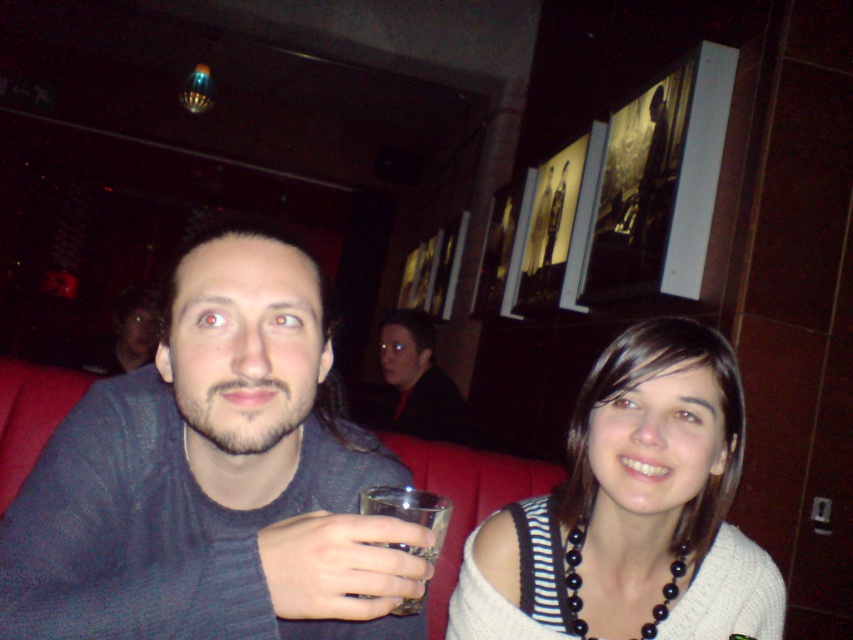
Question: Which point is closer to the camera?

Choices:
 (A) gray knit sweater at center
 (B) white knitted sweater at center
 (C) dark red fabric jacket at center

Answer: (A)

Question: Where is dark red fabric jacket at center located in relation to clear glass at lower center in the image?

Choices:
 (A) right
 (B) left

Answer: (B)

Question: Is gray knit sweater at center below transparent glass at lower center?

Choices:
 (A) yes
 (B) no

Answer: (B)

Question: Which of these objects is positioned farthest from the gray knit sweater at center?

Choices:
 (A) transparent glass at lower center
 (B) white knitted sweater at center

Answer: (B)

Question: Based on their relative distances, which object is farther from the clear glass at lower center?

Choices:
 (A) dark red fabric jacket at center
 (B) gray knit sweater at center
 (C) white knitted sweater at center

Answer: (A)

Question: Can you confirm if white knitted sweater at center is wider than dark red fabric jacket at center?

Choices:
 (A) yes
 (B) no

Answer: (A)